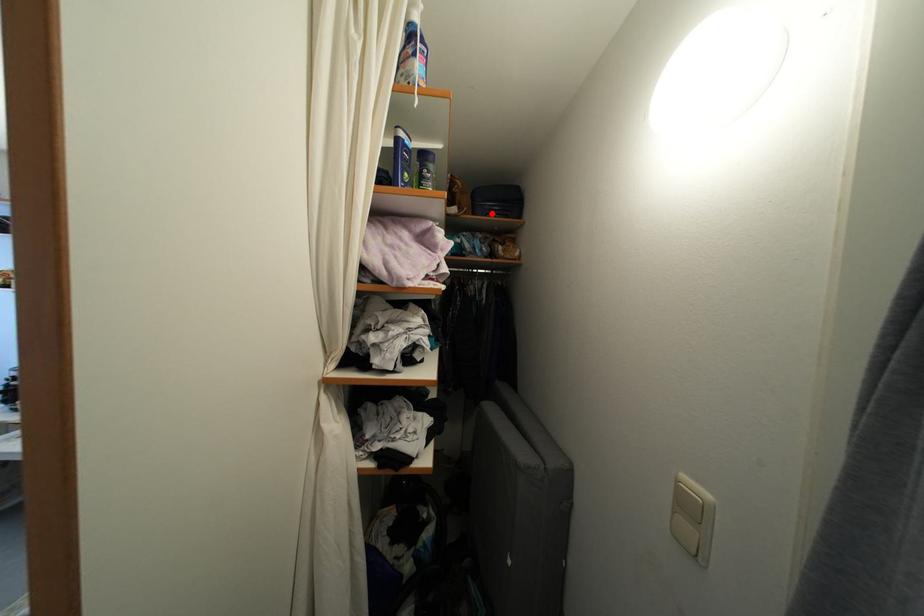
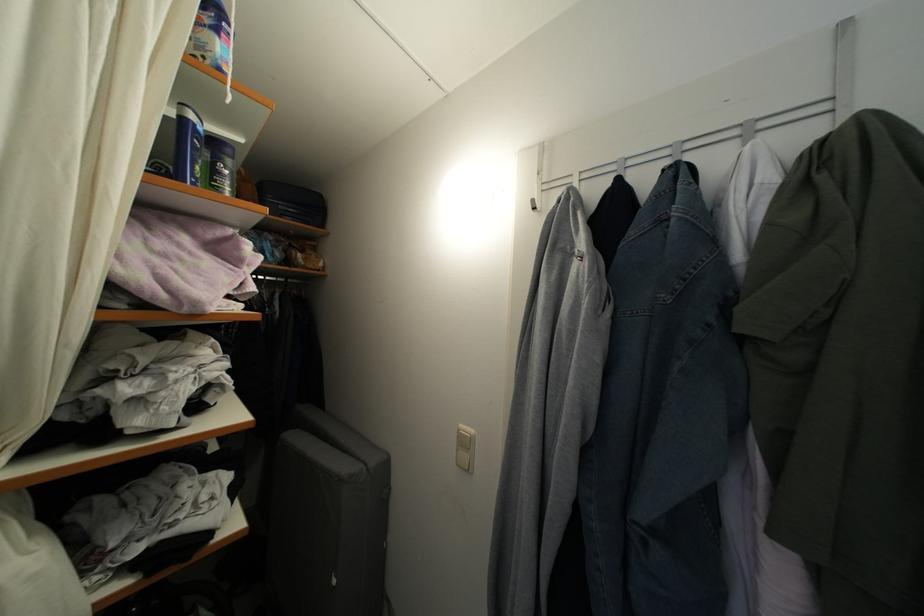
Locate, in the second image, the point that corresponds to the highlighted location in the first image.

(286, 214)